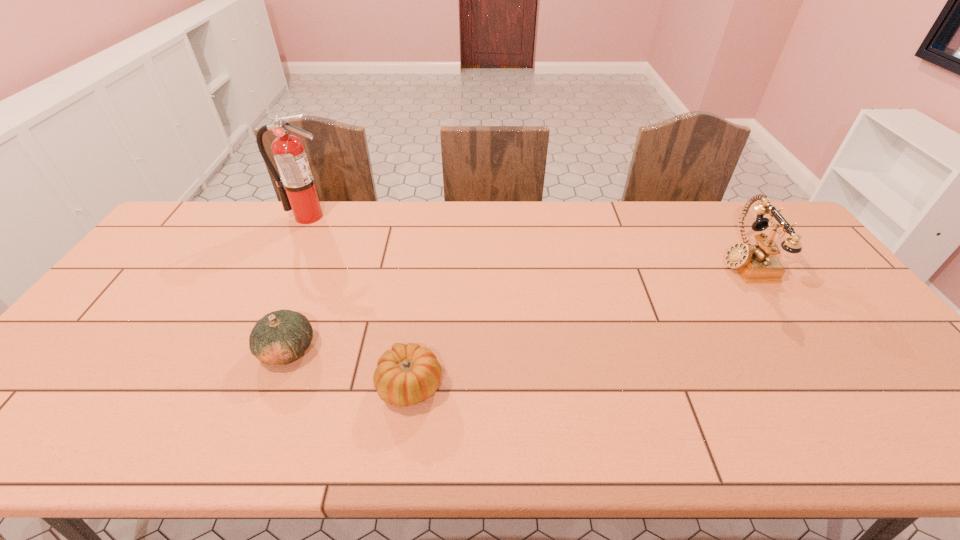
Locate an element on the screen. fire extinguisher is located at coordinates (296, 187).

Locate an element on the screen. the tallest object is located at coordinates (296, 187).

Locate an element on the screen. This screenshot has width=960, height=540. telephone is located at coordinates (x=757, y=263).

In order to click on the rightmost object in this screenshot , I will do `click(757, 263)`.

Find the location of `the taller gourd`. the taller gourd is located at coordinates (280, 337).

You are a GUI agent. You are given a task and a screenshot of the screen. Output one action in this format:
    pyautogui.click(x=<x>, y=<y>)
    Task: Click on the left gourd
    Image resolution: width=960 pixels, height=540 pixels.
    Given the screenshot: What is the action you would take?
    pyautogui.click(x=280, y=337)

Locate an element on the screen. The width and height of the screenshot is (960, 540). the right gourd is located at coordinates (406, 375).

The width and height of the screenshot is (960, 540). Identify the location of the shorter gourd. (406, 375).

In order to click on vacant region located on the nozzle side of the fire extinguisher in this screenshot , I will do `click(290, 253)`.

Where is `vacant area situated on the dial number of the third nearest object`? This screenshot has height=540, width=960. vacant area situated on the dial number of the third nearest object is located at coordinates (649, 261).